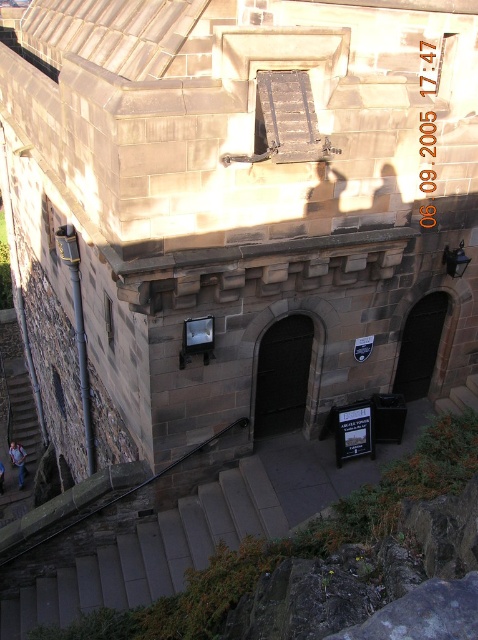
Is smooth stone stairs at lower center to the right of blue jeans at bottom left from the viewer's perspective?

Correct, you'll find smooth stone stairs at lower center to the right of blue jeans at bottom left.

Can you confirm if smooth stone stairs at lower center is positioned above blue jeans at bottom left?

Yes.

This screenshot has width=478, height=640. Describe the element at coordinates (152, 552) in the screenshot. I see `smooth stone stairs at lower center` at that location.

Find the location of a particular element. This screenshot has width=478, height=640. smooth stone stairs at lower center is located at coordinates (152, 552).

Is black stone door at center shorter than blue jeans at bottom left?

No.

Does black stone door at center appear on the right side of blue jeans at bottom left?

Correct, you'll find black stone door at center to the right of blue jeans at bottom left.

Which is behind, point (420, 369) or point (19, 454)?

Positioned behind is point (19, 454).

Identify the location of black stone door at center. The width and height of the screenshot is (478, 640). (420, 346).

Does wooden staircase at lower left have a greater width compared to blue jeans at bottom left?

Incorrect, wooden staircase at lower left's width does not surpass blue jeans at bottom left's.

From the picture: Which is more to the left, wooden staircase at lower left or blue jeans at bottom left?

wooden staircase at lower left

Who is more distant from viewer, (x=15, y=508) or (x=21, y=454)?

The point (x=21, y=454) is more distant.

Where is `wooden staircase at lower left`? wooden staircase at lower left is located at coordinates (19, 442).